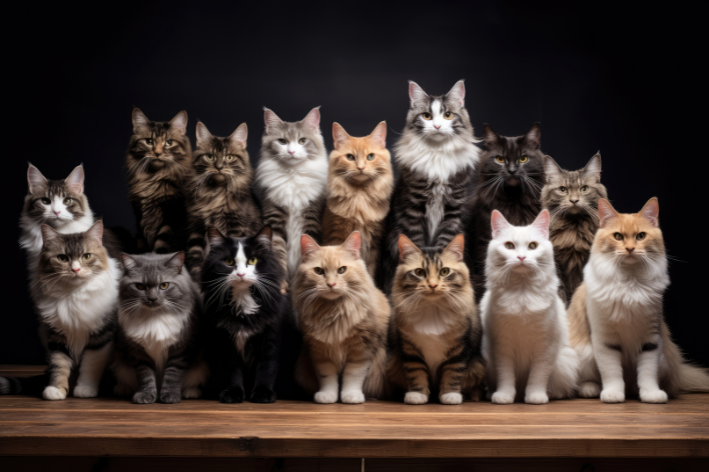
Image resolution: width=709 pixels, height=472 pixels. I want to click on white fur, so (x=523, y=320), (x=444, y=166), (x=296, y=185), (x=152, y=338), (x=89, y=319), (x=28, y=250), (x=615, y=299).